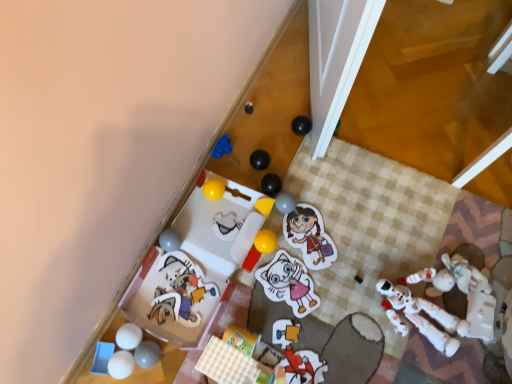
Locate an element on the screen. vacant space that's between cartoon cat plush at lower left, placed as the 11th toy when sorted from right to left, and rubber matte ball at center, marked as the third toy in a right-to-left arrangement is located at coordinates (234, 248).